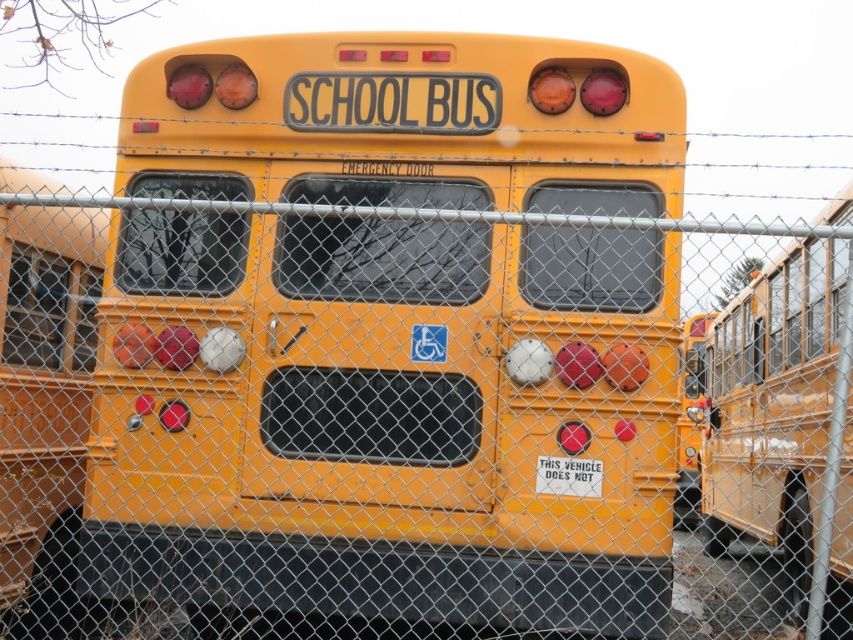
Does matte yellow school bus at right have a smaller size compared to white paper sign at center?

Incorrect, matte yellow school bus at right is not smaller in size than white paper sign at center.

Which is in front, point (838, 532) or point (549, 472)?

Point (549, 472) is in front.

Find the location of `matte yellow school bus at right`. matte yellow school bus at right is located at coordinates (785, 426).

Which is behind, point (527, 211) or point (589, 458)?

The point (527, 211) is behind.

This screenshot has height=640, width=853. What do you see at coordinates (384, 419) in the screenshot? I see `matte yellow school bus at center` at bounding box center [384, 419].

Image resolution: width=853 pixels, height=640 pixels. I want to click on matte yellow school bus at center, so click(x=384, y=419).

Does matte yellow school bus at center have a greater width compared to matte yellow school bus at right?

Indeed, matte yellow school bus at center has a greater width compared to matte yellow school bus at right.

This screenshot has height=640, width=853. Describe the element at coordinates (384, 419) in the screenshot. I see `matte yellow school bus at center` at that location.

At what (x,y) coordinates should I click in order to perform the action: click on matte yellow school bus at center. Please return your answer as a coordinate pair (x, y). The width and height of the screenshot is (853, 640). Looking at the image, I should click on pos(384,419).

Locate an element on the screen. This screenshot has height=640, width=853. matte yellow school bus at center is located at coordinates (384, 419).